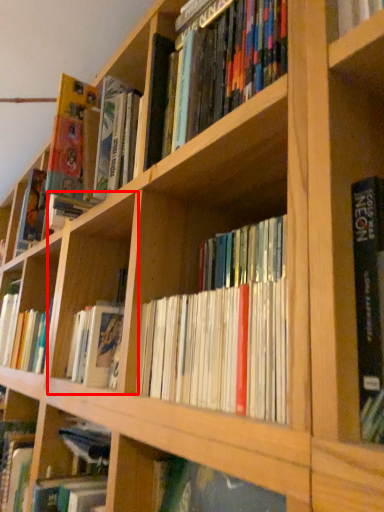
Question: From the image's perspective, considering the relative positions of cabinet (annotated by the red box) and shelf in the image provided, where is cabinet (annotated by the red box) located with respect to the staircase?

Choices:
 (A) above
 (B) below

Answer: (A)